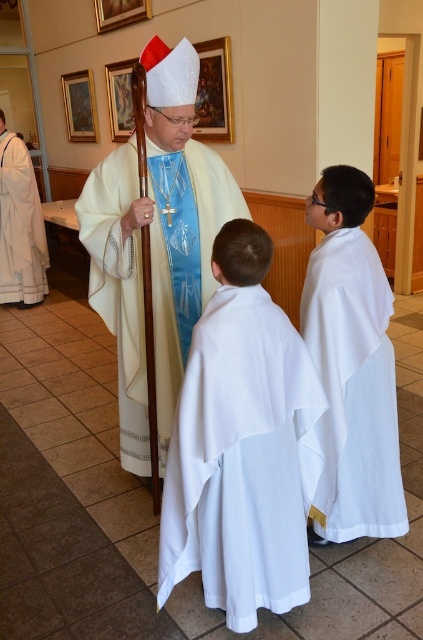
Question: Does white matte/soft fabric robe at center have a smaller size compared to white matte robe at center?

Choices:
 (A) yes
 (B) no

Answer: (A)

Question: Is white matte robe at center above white matte robe at left?

Choices:
 (A) yes
 (B) no

Answer: (B)

Question: Which object appears farthest from the camera in this image?

Choices:
 (A) white satin robe at center
 (B) white matte robe at left
 (C) white matte robe at center

Answer: (B)

Question: Based on their relative distances, which object is nearer to the white satin robe at center?

Choices:
 (A) white matte robe at center
 (B) white matte/soft fabric robe at center

Answer: (B)

Question: Is white matte robe at center wider than white matte robe at left?

Choices:
 (A) no
 (B) yes

Answer: (A)

Question: Which point appears closest to the camera in this image?

Choices:
 (A) (345, 272)
 (B) (167, 282)
 (C) (19, 289)
 (D) (279, 545)

Answer: (D)